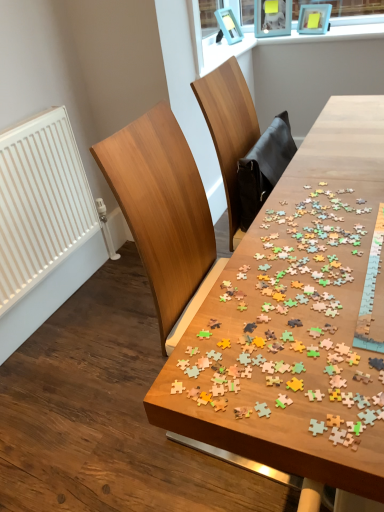
Where is `free space in front of white matte radiator at left`? free space in front of white matte radiator at left is located at coordinates (74, 374).